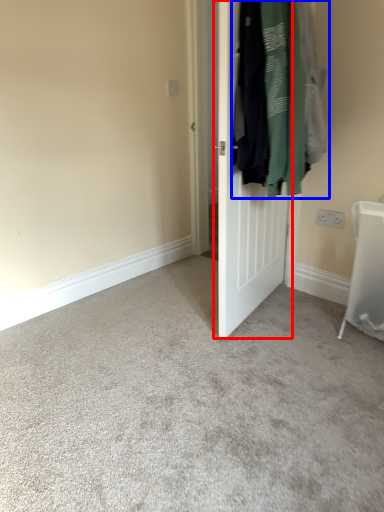
Question: Which point is further to the camera, door (highlighted by a red box) or laundry (highlighted by a blue box)?

Choices:
 (A) door
 (B) laundry

Answer: (A)